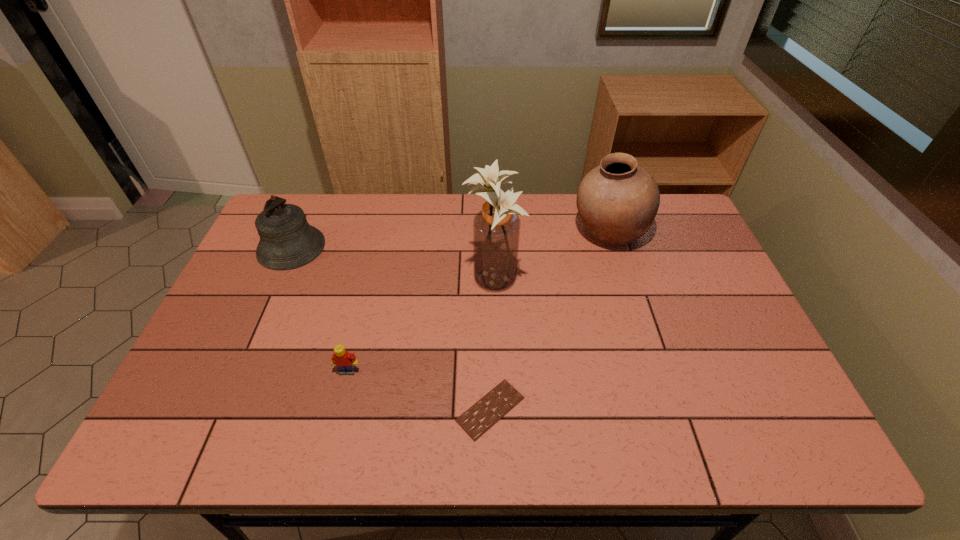
At what (x,y) coordinates should I click in order to perform the action: click on flower arrangement. Please return your answer as a coordinate pair (x, y). The height and width of the screenshot is (540, 960). Looking at the image, I should click on [496, 228].

This screenshot has width=960, height=540. What are the coordinates of `pottery` in the screenshot? It's located at point(617,201).

What are the coordinates of `the rightmost object` in the screenshot? It's located at (617, 201).

At what (x,y) coordinates should I click in order to perform the action: click on the leftmost object. Please return your answer as a coordinate pair (x, y). Looking at the image, I should click on (287, 241).

At what (x,y) coordinates should I click in order to perform the action: click on bell. Please return your answer as a coordinate pair (x, y). This screenshot has width=960, height=540. Looking at the image, I should click on (287, 241).

Locate an element on the screen. the fourth tallest object is located at coordinates pos(345,361).

The image size is (960, 540). I want to click on the second object from left to right, so (x=345, y=361).

The image size is (960, 540). What are the coordinates of `chocolate bar` in the screenshot? It's located at (479, 418).

Where is `the shortest object`? The height and width of the screenshot is (540, 960). the shortest object is located at coordinates (479, 418).

The width and height of the screenshot is (960, 540). I want to click on vacant space located on the front of the flower arrangement, so click(495, 336).